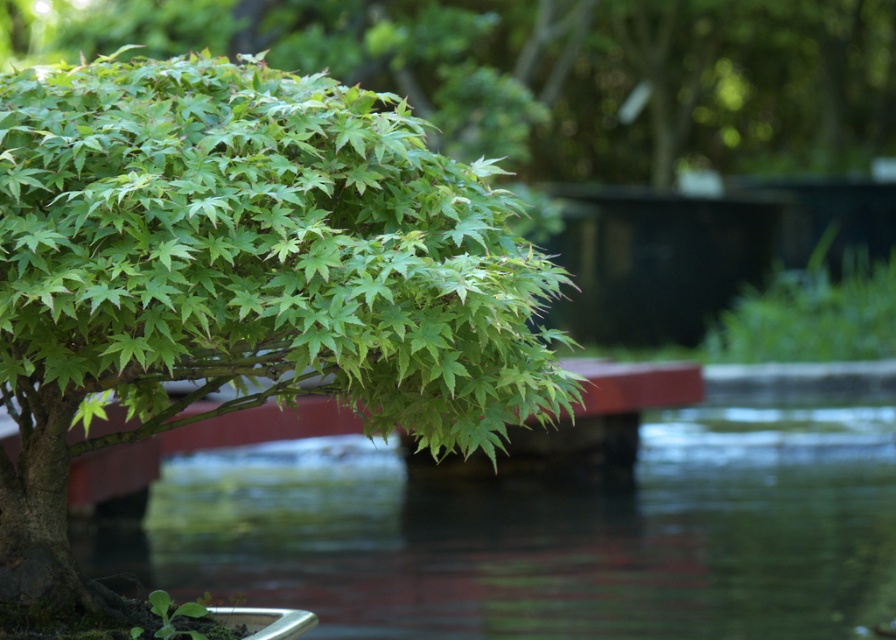
Question: Observing the image, what is the correct spatial positioning of green leafy tree at left in reference to transparent water at lower center?

Choices:
 (A) left
 (B) right

Answer: (A)

Question: Can you confirm if green leafy tree at left is bigger than transparent water at lower center?

Choices:
 (A) no
 (B) yes

Answer: (B)

Question: Is green leafy tree at left positioned behind transparent water at lower center?

Choices:
 (A) yes
 (B) no

Answer: (B)

Question: Which of the following is the closest to the observer?

Choices:
 (A) transparent water at lower center
 (B) green leafy tree at left

Answer: (B)